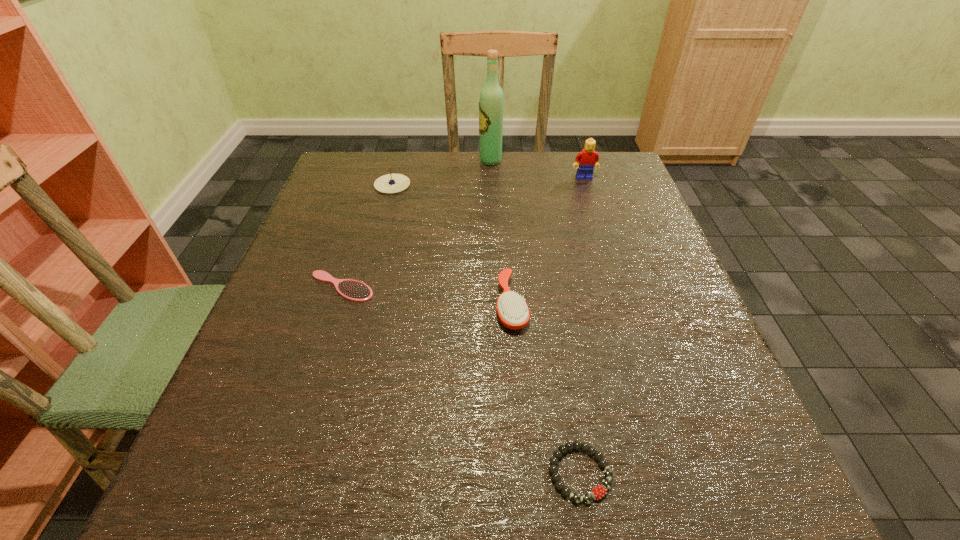
What are the coordinates of `the farthest object` in the screenshot? It's located at (491, 102).

Locate an element on the screen. This screenshot has height=540, width=960. the tallest object is located at coordinates (491, 102).

Where is `Lego`? The width and height of the screenshot is (960, 540). Lego is located at coordinates (588, 159).

I want to click on the rightmost object, so click(x=588, y=159).

This screenshot has width=960, height=540. Find the location of `compass`. compass is located at coordinates (391, 183).

I want to click on the right hairbrush, so click(513, 312).

The height and width of the screenshot is (540, 960). Find the location of `the taller hairbrush`. the taller hairbrush is located at coordinates (513, 312).

Find the location of a particular element. the shorter hairbrush is located at coordinates (354, 290).

Locate an element on the screen. This screenshot has width=960, height=540. the left hairbrush is located at coordinates (354, 290).

Identify the location of the nearest object. (598, 492).